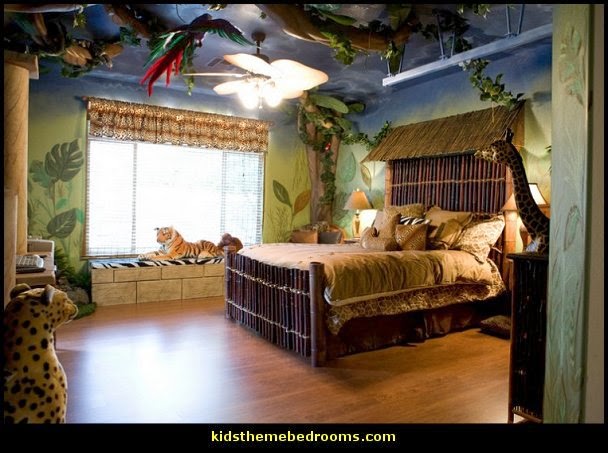
Where is `wood floor`? The height and width of the screenshot is (453, 608). wood floor is located at coordinates (278, 401).